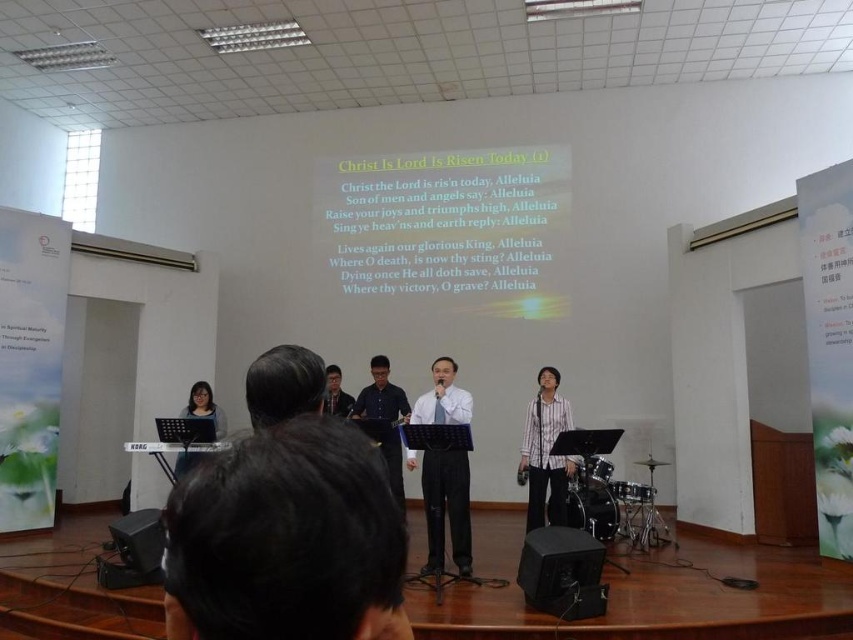
Question: Which point is farther to the camera?

Choices:
 (A) matte black laptop at lower left
 (B) yellow paper at center
 (C) black shirt at center

Answer: (B)

Question: Is yellow paper at center bigger than white glossy shirt at center?

Choices:
 (A) yes
 (B) no

Answer: (A)

Question: Among these points, which one is farthest from the camera?

Choices:
 (A) (575, 540)
 (B) (566, 410)
 (C) (184, 410)
 (D) (405, 188)

Answer: (D)

Question: Is black hair at center thinner than yellow paper at center?

Choices:
 (A) yes
 (B) no

Answer: (A)

Question: Does yellow paper at center appear on the left side of matte black laptop at lower left?

Choices:
 (A) yes
 (B) no

Answer: (B)

Question: Which of the following is the farthest from the observer?

Choices:
 (A) (337, 372)
 (B) (433, 419)
 (C) (387, 512)

Answer: (A)